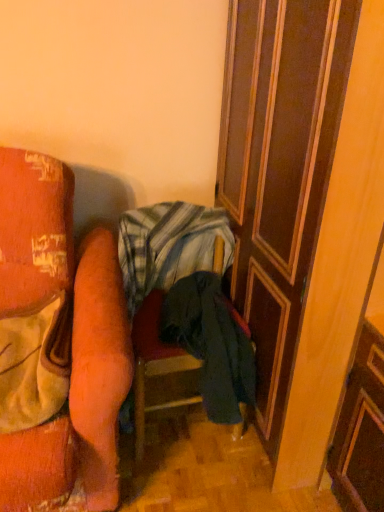
Question: Considering the relative positions of striped cotton blanket at center and wooden at right in the image provided, is striped cotton blanket at center to the left of wooden at right from the viewer's perspective?

Choices:
 (A) yes
 (B) no

Answer: (A)

Question: Does striped cotton blanket at center have a lesser height compared to wooden at right?

Choices:
 (A) yes
 (B) no

Answer: (A)

Question: From the image's perspective, is striped cotton blanket at center under wooden at right?

Choices:
 (A) no
 (B) yes

Answer: (B)

Question: Is striped cotton blanket at center facing towards wooden at right?

Choices:
 (A) yes
 (B) no

Answer: (B)

Question: Considering the relative positions of striped cotton blanket at center and wooden at right in the image provided, is striped cotton blanket at center to the right of wooden at right from the viewer's perspective?

Choices:
 (A) no
 (B) yes

Answer: (A)

Question: From a real-world perspective, is striped cotton blanket at center over wooden at right?

Choices:
 (A) no
 (B) yes

Answer: (A)

Question: Can you confirm if wooden at right is taller than striped cotton blanket at center?

Choices:
 (A) yes
 (B) no

Answer: (A)

Question: Does wooden at right appear on the left side of striped cotton blanket at center?

Choices:
 (A) no
 (B) yes

Answer: (A)

Question: Is wooden at right further to camera compared to striped cotton blanket at center?

Choices:
 (A) yes
 (B) no

Answer: (B)

Question: Can you confirm if wooden at right is wider than striped cotton blanket at center?

Choices:
 (A) no
 (B) yes

Answer: (B)

Question: Considering the relative positions of wooden at right and striped cotton blanket at center in the image provided, is wooden at right to the right of striped cotton blanket at center from the viewer's perspective?

Choices:
 (A) no
 (B) yes

Answer: (B)

Question: Is wooden at right thinner than striped cotton blanket at center?

Choices:
 (A) yes
 (B) no

Answer: (B)

Question: Considering the relative sizes of striped cotton blanket at center and dark blue fabric chair at center in the image provided, is striped cotton blanket at center smaller than dark blue fabric chair at center?

Choices:
 (A) yes
 (B) no

Answer: (A)